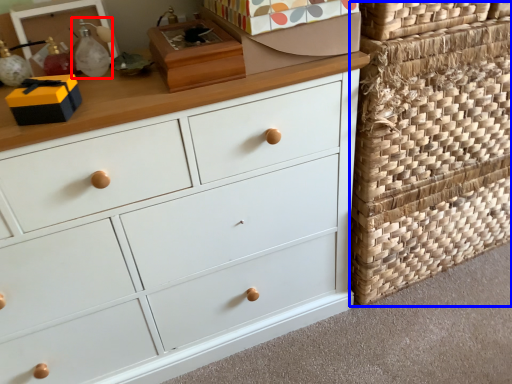
Question: Which point is further to the camera, toy (highlighted by a red box) or basket (highlighted by a blue box)?

Choices:
 (A) toy
 (B) basket

Answer: (B)